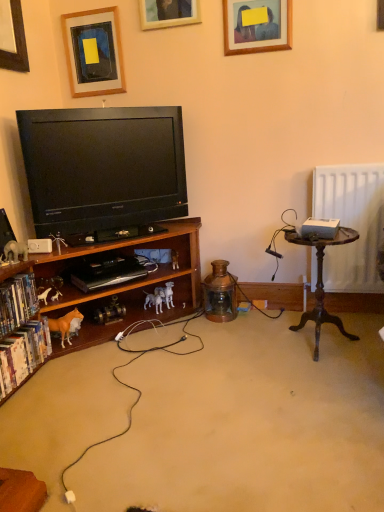
In order to click on vacant area that lies to the right of copper glass lantern at center, the second toy when ordered from back to front in this screenshot , I will do `click(257, 318)`.